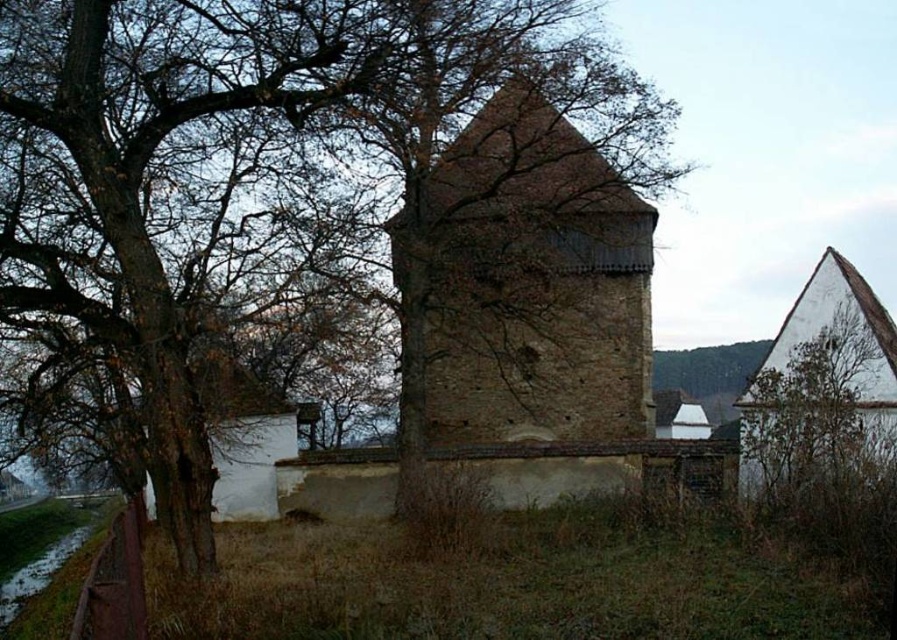
Which of these two, brown rough bark tree at center or brown stone church tower at center, stands taller?

With more height is brown rough bark tree at center.

Can you confirm if brown rough bark tree at center is positioned to the right of brown stone church tower at center?

No, brown rough bark tree at center is not to the right of brown stone church tower at center.

Which is behind, point (544, 227) or point (608, 312)?

Point (608, 312)

What are the coordinates of `brown rough bark tree at center` in the screenshot? It's located at (377, 179).

Between brown stone church tower at center and white matte tree at right, which one appears on the right side from the viewer's perspective?

From the viewer's perspective, white matte tree at right appears more on the right side.

Between point (521, 122) and point (835, 413), which one is positioned in front?

Point (835, 413)

Describe the element at coordinates (529, 284) in the screenshot. I see `brown stone church tower at center` at that location.

Find the location of a particular element. brown stone church tower at center is located at coordinates (529, 284).

This screenshot has height=640, width=897. What do you see at coordinates (377, 179) in the screenshot? I see `brown rough bark tree at center` at bounding box center [377, 179].

Between point (205, 92) and point (782, 426), which one is positioned in front?

Point (205, 92) is in front.

Measure the distance between brown rough bark tree at center and camera.

brown rough bark tree at center and camera are 12.48 meters apart from each other.

Find the location of a particular element. The width and height of the screenshot is (897, 640). brown rough bark tree at center is located at coordinates (377, 179).